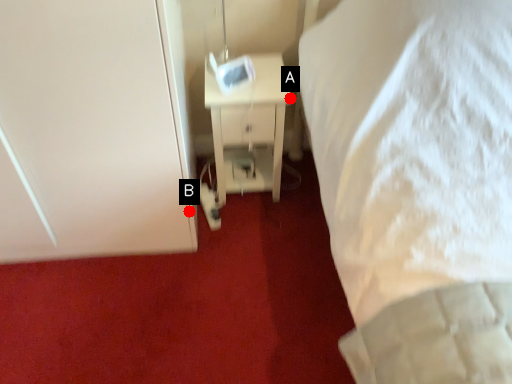
Question: Two points are circled on the image, labeled by A and B beside each circle. Among these points, which one is nearest to the camera?

Choices:
 (A) A is closer
 (B) B is closer

Answer: (B)